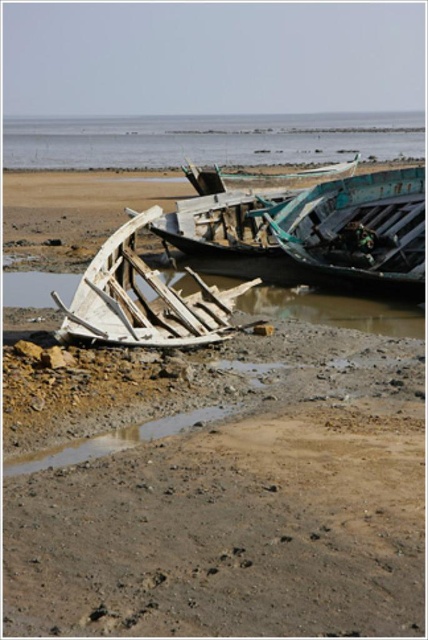
Question: Which point is farther to the camera?

Choices:
 (A) teal wooden boat at upper center
 (B) white wooden boat at center
 (C) brown wood water at lower center
 (D) wooden planks boat at center

Answer: (A)

Question: Does clear blue water at upper center appear under white wooden boat at center?

Choices:
 (A) no
 (B) yes

Answer: (A)

Question: Which object is closer to the camera taking this photo?

Choices:
 (A) clear blue water at upper center
 (B) white wooden boat at center

Answer: (B)

Question: Which object is farther from the camera taking this photo?

Choices:
 (A) clear blue water at upper center
 (B) teal wooden boat at upper center
 (C) wooden planks boat at center
 (D) brown wood water at lower center

Answer: (A)

Question: Is clear blue water at upper center thinner than white wooden boat at center?

Choices:
 (A) no
 (B) yes

Answer: (A)

Question: Can you confirm if white wooden boat at center is bigger than wooden planks boat at center?

Choices:
 (A) yes
 (B) no

Answer: (B)